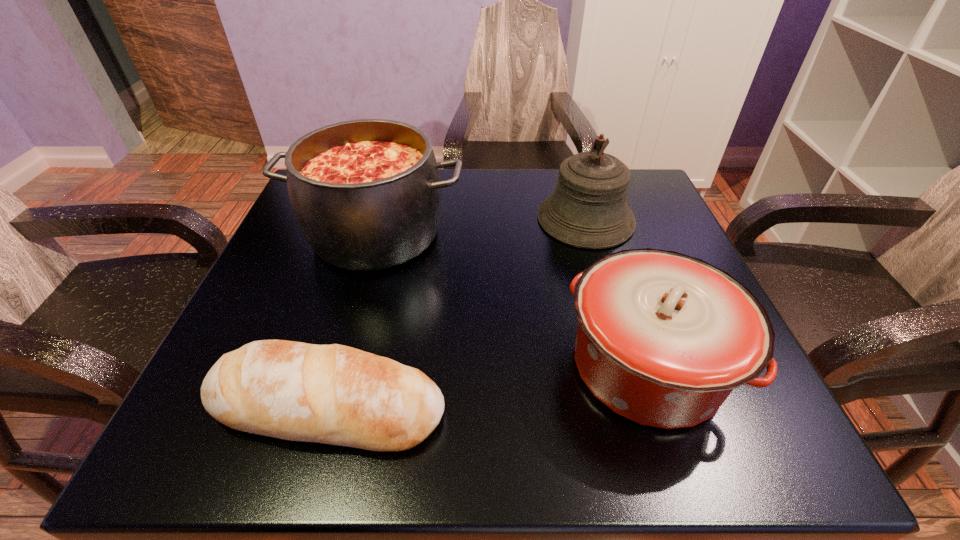
The image size is (960, 540). What are the coordinates of `bell` in the screenshot? It's located at (588, 209).

In order to click on the taller casserole in this screenshot , I will do `click(366, 193)`.

Locate an element on the screen. The height and width of the screenshot is (540, 960). the left casserole is located at coordinates (366, 193).

What are the coordinates of `the shorter casserole` in the screenshot? It's located at (663, 338).

I want to click on the nearer casserole, so click(663, 338).

The width and height of the screenshot is (960, 540). What are the coordinates of `the shortest object` in the screenshot? It's located at (333, 394).

Locate an element on the screen. This screenshot has width=960, height=540. vacant point located 0.360m on the left of the bell is located at coordinates (x=376, y=219).

Identify the location of vacant space located 0.400m on the right of the farther casserole. This screenshot has height=540, width=960. (651, 234).

Locate an element on the screen. This screenshot has width=960, height=540. free region located 0.150m on the left of the second shortest object is located at coordinates (468, 366).

The height and width of the screenshot is (540, 960). I want to click on free space located 0.120m on the right of the bread, so click(528, 406).